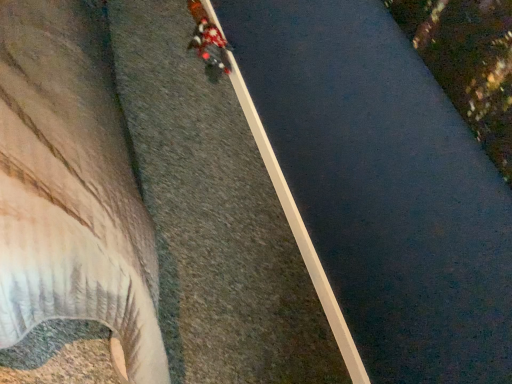
Find the location of a particular element. vacant space in red fabric jacket at upper center (from a real-world perspective) is located at coordinates (206, 57).